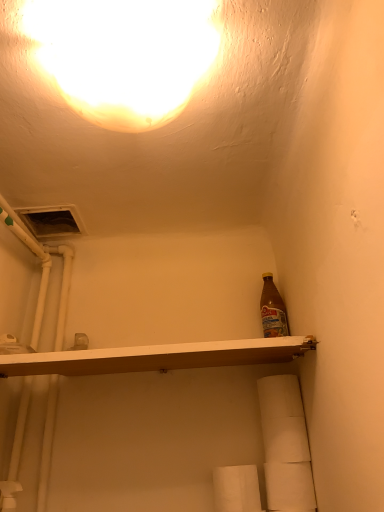
Describe the element at coordinates (157, 357) in the screenshot. I see `white wood shelf at center` at that location.

Describe the element at coordinates (289, 486) in the screenshot. I see `white matte toilet paper at lower right, the second toilet paper from the bottom` at that location.

The width and height of the screenshot is (384, 512). Describe the element at coordinates (279, 397) in the screenshot. I see `white matte toilet paper at lower right, marked as the first toilet paper in a top-to-bottom arrangement` at that location.

Where is `matte yellow light at upper center`? Image resolution: width=384 pixels, height=512 pixels. matte yellow light at upper center is located at coordinates (124, 55).

Looking at this image, is white matte toilet paper at lower right, which is the 2th toilet paper in top-to-bottom order, facing away from white matte toilet paper at lower right, marked as the first toilet paper in a top-to-bottom arrangement?

That's not correct — white matte toilet paper at lower right, which is the 2th toilet paper in top-to-bottom order, is not looking away from white matte toilet paper at lower right, marked as the first toilet paper in a top-to-bottom arrangement.

Considering the positions of objects white matte toilet paper at lower right, which is the third toilet paper in bottom-to-top order, and white matte toilet paper at lower right, marked as the first toilet paper in a top-to-bottom arrangement, in the image provided, who is more to the left, white matte toilet paper at lower right, which is the third toilet paper in bottom-to-top order, or white matte toilet paper at lower right, marked as the first toilet paper in a top-to-bottom arrangement,?

Positioned to the left is white matte toilet paper at lower right, marked as the first toilet paper in a top-to-bottom arrangement.

Are white matte toilet paper at lower right, which is the 2th toilet paper in top-to-bottom order, and white matte toilet paper at lower right, marked as the first toilet paper in a top-to-bottom arrangement, far apart?

No.

Which of these two, white matte toilet paper at lower right, which is the 3th toilet paper in top-to-bottom order, or white paper towel at lower center, the first toilet paper positioned from the bottom, stands taller?

Standing taller between the two is white paper towel at lower center, the first toilet paper positioned from the bottom.

Considering the relative positions of white matte toilet paper at lower right, the second toilet paper from the bottom, and white paper towel at lower center, placed as the fourth toilet paper when sorted from top to bottom, in the image provided, is white matte toilet paper at lower right, the second toilet paper from the bottom, behind white paper towel at lower center, placed as the fourth toilet paper when sorted from top to bottom,?

Yes, it is behind white paper towel at lower center, placed as the fourth toilet paper when sorted from top to bottom.

How many degrees apart are the facing directions of white matte toilet paper at lower right, which is the 3th toilet paper in top-to-bottom order, and white paper towel at lower center, the first toilet paper positioned from the bottom?

2.05 degrees.

Considering the relative sizes of white matte toilet paper at lower right, the second toilet paper from the bottom, and white paper towel at lower center, placed as the fourth toilet paper when sorted from top to bottom, in the image provided, is white matte toilet paper at lower right, the second toilet paper from the bottom, wider than white paper towel at lower center, placed as the fourth toilet paper when sorted from top to bottom,?

No, white matte toilet paper at lower right, the second toilet paper from the bottom, is not wider than white paper towel at lower center, placed as the fourth toilet paper when sorted from top to bottom.

Is matte yellow light at upper center to the right of white matte toilet paper at lower right, the second toilet paper from the bottom, from the viewer's perspective?

In fact, matte yellow light at upper center is to the left of white matte toilet paper at lower right, the second toilet paper from the bottom.

Is matte yellow light at upper center smaller than white matte toilet paper at lower right, the second toilet paper from the bottom?

No.

This screenshot has width=384, height=512. Identify the location of light lying on the left of white matte toilet paper at lower right, which is the 3th toilet paper in top-to-bottom order. (124, 55).

Considering the relative sizes of matte yellow light at upper center and white matte toilet paper at lower right, which is the 3th toilet paper in top-to-bottom order, in the image provided, is matte yellow light at upper center shorter than white matte toilet paper at lower right, which is the 3th toilet paper in top-to-bottom order,?

Correct, matte yellow light at upper center is not as tall as white matte toilet paper at lower right, which is the 3th toilet paper in top-to-bottom order.

Which object is positioned more to the left, matte yellow light at upper center or white matte toilet paper at lower right, which is the third toilet paper in bottom-to-top order?

From the viewer's perspective, matte yellow light at upper center appears more on the left side.

Would you say matte yellow light at upper center is outside white matte toilet paper at lower right, which is the 2th toilet paper in top-to-bottom order?

Absolutely, matte yellow light at upper center is external to white matte toilet paper at lower right, which is the 2th toilet paper in top-to-bottom order.

Considering the points (68, 96) and (272, 460), which point is behind, point (68, 96) or point (272, 460)?

The point (272, 460) is farther.

From the image's perspective, who appears lower, matte yellow light at upper center or white matte toilet paper at lower right, which is the 2th toilet paper in top-to-bottom order?

white matte toilet paper at lower right, which is the 2th toilet paper in top-to-bottom order, appears lower in the image.

Is white matte toilet paper at lower right, which is the 2th toilet paper in top-to-bottom order, closer to camera compared to white paper towel at lower center, placed as the fourth toilet paper when sorted from top to bottom?

No, white matte toilet paper at lower right, which is the 2th toilet paper in top-to-bottom order, is further to the viewer.

Are white matte toilet paper at lower right, which is the 2th toilet paper in top-to-bottom order, and white paper towel at lower center, placed as the fourth toilet paper when sorted from top to bottom, far apart?

They are positioned close to each other.

Is white paper towel at lower center, the first toilet paper positioned from the bottom, located within white matte toilet paper at lower right, which is the 2th toilet paper in top-to-bottom order?

No, white paper towel at lower center, the first toilet paper positioned from the bottom, is not inside white matte toilet paper at lower right, which is the 2th toilet paper in top-to-bottom order.

From the image's perspective, who appears lower, white matte toilet paper at lower right, marked as the first toilet paper in a top-to-bottom arrangement, or white matte toilet paper at lower right, which is the 2th toilet paper in top-to-bottom order?

white matte toilet paper at lower right, which is the 2th toilet paper in top-to-bottom order.

Is white matte toilet paper at lower right, marked as the first toilet paper in a top-to-bottom arrangement, not within white matte toilet paper at lower right, which is the third toilet paper in bottom-to-top order?

That's correct, white matte toilet paper at lower right, marked as the first toilet paper in a top-to-bottom arrangement, is outside of white matte toilet paper at lower right, which is the third toilet paper in bottom-to-top order.

Which is farther, (298, 396) or (299, 437)?

The point (298, 396) is farther from the camera.

Consider the image. From a real-world perspective, is white matte toilet paper at lower right, marked as the first toilet paper in a top-to-bottom arrangement, physically above white matte toilet paper at lower right, which is the 2th toilet paper in top-to-bottom order?

Yes, from a real-world perspective, white matte toilet paper at lower right, marked as the first toilet paper in a top-to-bottom arrangement, is on top of white matte toilet paper at lower right, which is the 2th toilet paper in top-to-bottom order.

Considering the relative positions of white matte toilet paper at lower right, the second toilet paper from the bottom, and white matte toilet paper at lower right, marked as the first toilet paper in a top-to-bottom arrangement, in the image provided, is white matte toilet paper at lower right, the second toilet paper from the bottom, to the right of white matte toilet paper at lower right, marked as the first toilet paper in a top-to-bottom arrangement, from the viewer's perspective?

Yes, white matte toilet paper at lower right, the second toilet paper from the bottom, is to the right of white matte toilet paper at lower right, marked as the first toilet paper in a top-to-bottom arrangement.

Considering the relative sizes of white matte toilet paper at lower right, the second toilet paper from the bottom, and white matte toilet paper at lower right, the 4th toilet paper positioned from the bottom, in the image provided, is white matte toilet paper at lower right, the second toilet paper from the bottom, shorter than white matte toilet paper at lower right, the 4th toilet paper positioned from the bottom,?

Yes.

Does point (275, 468) come farther from viewer compared to point (265, 392)?

No.

Looking at this image, between white matte toilet paper at lower right, the second toilet paper from the bottom, and white matte toilet paper at lower right, marked as the first toilet paper in a top-to-bottom arrangement, which one has smaller size?

white matte toilet paper at lower right, the second toilet paper from the bottom.

I want to click on the 1st toilet paper to the right of the white matte toilet paper at lower right, marked as the first toilet paper in a top-to-bottom arrangement, starting your count from the anchor, so click(286, 440).

Which toilet paper is the 1st one when counting from the back of the white paper towel at lower center, placed as the fourth toilet paper when sorted from top to bottom? Please provide its 2D coordinates.

[(289, 486)]

Considering their positions, is white matte toilet paper at lower right, marked as the first toilet paper in a top-to-bottom arrangement, positioned further to white matte toilet paper at lower right, which is the 3th toilet paper in top-to-bottom order, than matte yellow light at upper center?

matte yellow light at upper center is positioned further to the anchor white matte toilet paper at lower right, which is the 3th toilet paper in top-to-bottom order.

When comparing their distances from white matte toilet paper at lower right, which is the 2th toilet paper in top-to-bottom order, does white matte toilet paper at lower right, marked as the first toilet paper in a top-to-bottom arrangement, or matte yellow light at upper center seem further?

matte yellow light at upper center lies further to white matte toilet paper at lower right, which is the 2th toilet paper in top-to-bottom order, than the other object.

Based on their spatial positions, is white paper towel at lower center, placed as the fourth toilet paper when sorted from top to bottom, or white matte toilet paper at lower right, which is the 2th toilet paper in top-to-bottom order, closer to white matte toilet paper at lower right, marked as the first toilet paper in a top-to-bottom arrangement?

white matte toilet paper at lower right, which is the 2th toilet paper in top-to-bottom order, lies closer to white matte toilet paper at lower right, marked as the first toilet paper in a top-to-bottom arrangement, than the other object.

When comparing their distances from matte yellow light at upper center, does white matte toilet paper at lower right, which is the 2th toilet paper in top-to-bottom order, or white matte toilet paper at lower right, marked as the first toilet paper in a top-to-bottom arrangement, seem further?

white matte toilet paper at lower right, which is the 2th toilet paper in top-to-bottom order, is positioned further to the anchor matte yellow light at upper center.

From the image, which object appears to be farther from matte yellow light at upper center, white wood shelf at center or white paper towel at lower center, placed as the fourth toilet paper when sorted from top to bottom?

white paper towel at lower center, placed as the fourth toilet paper when sorted from top to bottom.

From the image, which object appears to be farther from matte yellow light at upper center, white paper towel at lower center, placed as the fourth toilet paper when sorted from top to bottom, or white matte toilet paper at lower right, the 4th toilet paper positioned from the bottom?

white paper towel at lower center, placed as the fourth toilet paper when sorted from top to bottom, is positioned further to the anchor matte yellow light at upper center.

Considering their positions, is white paper towel at lower center, placed as the fourth toilet paper when sorted from top to bottom, positioned further to white matte toilet paper at lower right, marked as the first toilet paper in a top-to-bottom arrangement, than matte yellow light at upper center?

Based on the image, matte yellow light at upper center appears to be further to white matte toilet paper at lower right, marked as the first toilet paper in a top-to-bottom arrangement.

Looking at the image, which one is located closer to white matte toilet paper at lower right, which is the third toilet paper in bottom-to-top order, white matte toilet paper at lower right, the second toilet paper from the bottom, or white wood shelf at center?

Among the two, white matte toilet paper at lower right, the second toilet paper from the bottom, is located nearer to white matte toilet paper at lower right, which is the third toilet paper in bottom-to-top order.

Locate an element on the screen. shelf between matte yellow light at upper center and white matte toilet paper at lower right, the second toilet paper from the bottom, in the vertical direction is located at coordinates (157, 357).

Identify the location of shelf between matte yellow light at upper center and white matte toilet paper at lower right, the 4th toilet paper positioned from the bottom, in the vertical direction. This screenshot has height=512, width=384. (157, 357).

You are a GUI agent. You are given a task and a screenshot of the screen. Output one action in this format:
    pyautogui.click(x=<x>, y=<y>)
    Task: Click on the toilet paper between white matte toilet paper at lower right, marked as the first toilet paper in a top-to-bottom arrangement, and white matte toilet paper at lower right, which is the 3th toilet paper in top-to-bottom order, in the up-down direction
    The image size is (384, 512).
    Given the screenshot: What is the action you would take?
    pyautogui.click(x=286, y=440)

Locate an element on the screen. The image size is (384, 512). shelf between matte yellow light at upper center and white matte toilet paper at lower right, which is the 2th toilet paper in top-to-bottom order, in the up-down direction is located at coordinates (157, 357).